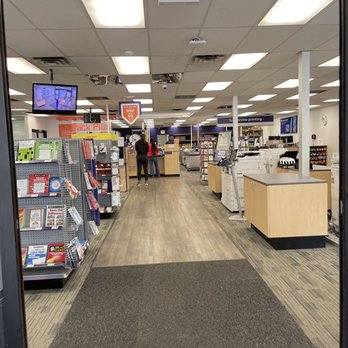
The height and width of the screenshot is (348, 348). I want to click on white security camera, so click(164, 88).